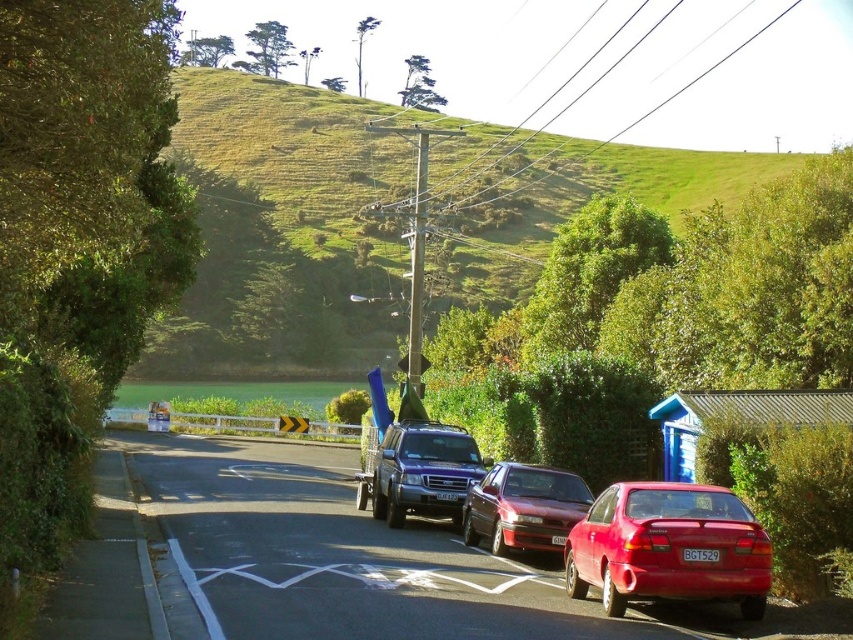
Does point (207, 563) come in front of point (497, 502)?

Yes, point (207, 563) is in front of point (497, 502).

Measure the distance from metallic red car at center to shiny red sedan at center.

They are 2.03 meters apart.

Describe the element at coordinates (381, 561) in the screenshot. I see `metallic red car at center` at that location.

Where is `metallic red car at center`? Image resolution: width=853 pixels, height=640 pixels. metallic red car at center is located at coordinates (381, 561).

Can you confirm if satin black suv at center is bigger than shiny red sedan at center?

Indeed, satin black suv at center has a larger size compared to shiny red sedan at center.

This screenshot has height=640, width=853. Describe the element at coordinates (421, 472) in the screenshot. I see `satin black suv at center` at that location.

Find the location of a particular element. Image resolution: width=853 pixels, height=640 pixels. satin black suv at center is located at coordinates (421, 472).

Is metallic red car at center bigger than satin black suv at center?

Indeed, metallic red car at center has a larger size compared to satin black suv at center.

Who is taller, metallic red car at center or satin black suv at center?

satin black suv at center is taller.

Which is in front, point (241, 616) or point (444, 442)?

Point (241, 616)

Locate an element on the screen. This screenshot has width=853, height=640. metallic red car at center is located at coordinates (381, 561).